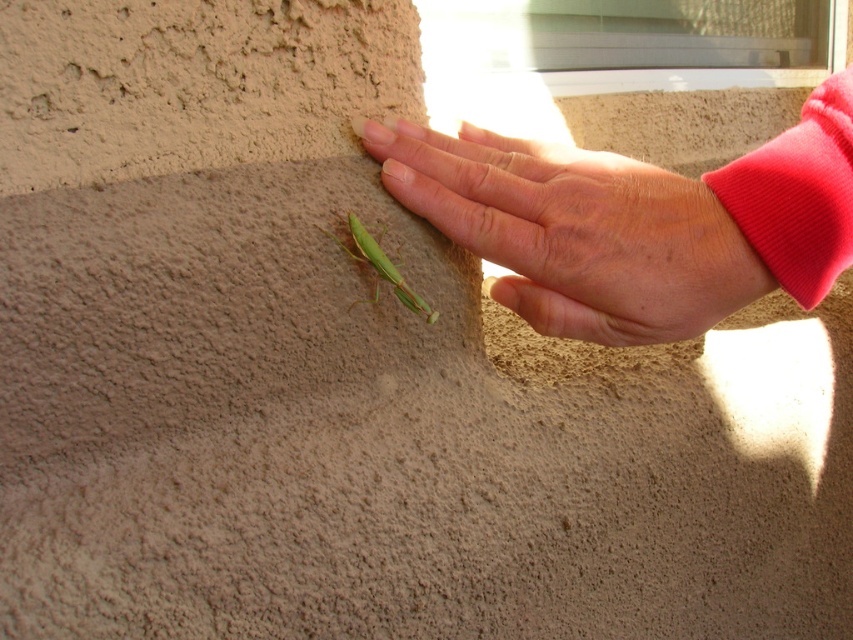
Is smooth skin hand at center in front of green matte insect at center?

Yes, smooth skin hand at center is in front of green matte insect at center.

Does smooth skin hand at center have a lesser width compared to green matte insect at center?

No, smooth skin hand at center is not thinner than green matte insect at center.

Identify the location of smooth skin hand at center. (575, 230).